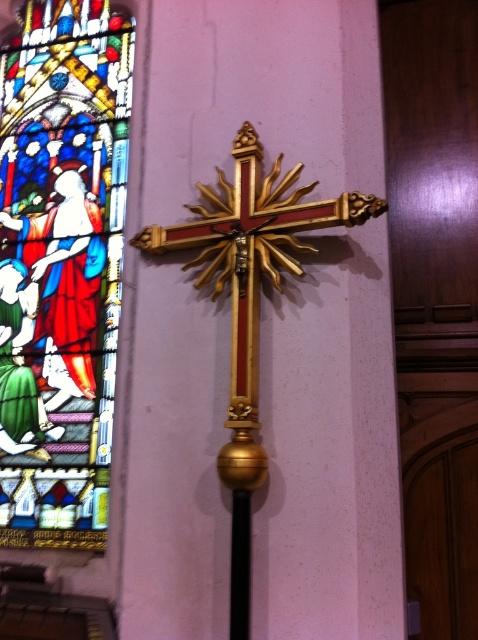
You are an interior designer planning to install a new light fixture between the stained glass window at left and the gold polished crucifix at center. Based on their sizes, which object should the light fixture be closer to?

The stained glass window at left is larger than the gold polished crucifix at center, so the light fixture should be placed closer to the gold polished crucifix at center to maintain balance.

Looking at this image, you are standing in the church and want to take a photo of both the stained glass window at left and the gold polished crucifix at center. Which object should you focus on first if you want to capture both in the same frame without moving the camera?

The stained glass window at left is positioned over the gold polished crucifix at center, so you should focus on the gold polished crucifix at center first to ensure it is fully visible in the frame.